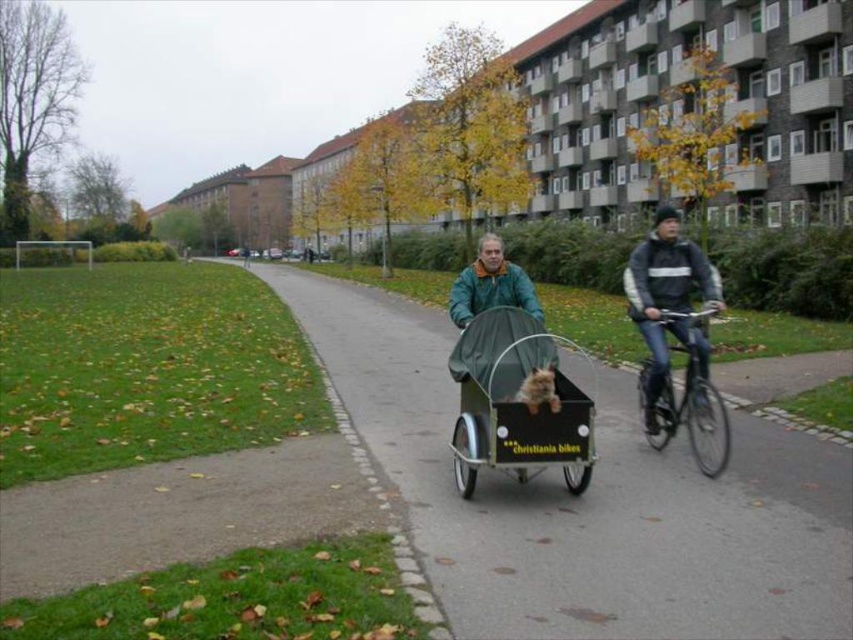
Is green fabric baby carriage at center positioned at the back of dark gray jacket at center right?

No.

Which is more to the left, green fabric baby carriage at center or dark gray jacket at center right?

Positioned to the left is green fabric baby carriage at center.

Is point (461, 442) closer to viewer compared to point (718, 289)?

Yes.

At what (x,y) coordinates should I click in order to perform the action: click on green fabric baby carriage at center. Please return your answer as a coordinate pair (x, y). This screenshot has height=640, width=853. Looking at the image, I should click on (515, 403).

Does green fabric cart at center have a larger size compared to shiny black bicycle at center right?

Yes, green fabric cart at center is bigger than shiny black bicycle at center right.

Which is in front, point (436, 368) or point (720, 400)?

Point (720, 400) is in front.

Is point (403, 451) farther from camera compared to point (682, 310)?

Yes, point (403, 451) is behind point (682, 310).

Identify the location of green fabric cart at center. The image size is (853, 640). (585, 499).

Between point (674, 324) and point (648, 362), which one is positioned in front?

Positioned in front is point (674, 324).

Is dark gray jacket at center right wider than shiny black bicycle at center right?

Indeed, dark gray jacket at center right has a greater width compared to shiny black bicycle at center right.

Identify the location of dark gray jacket at center right. (664, 292).